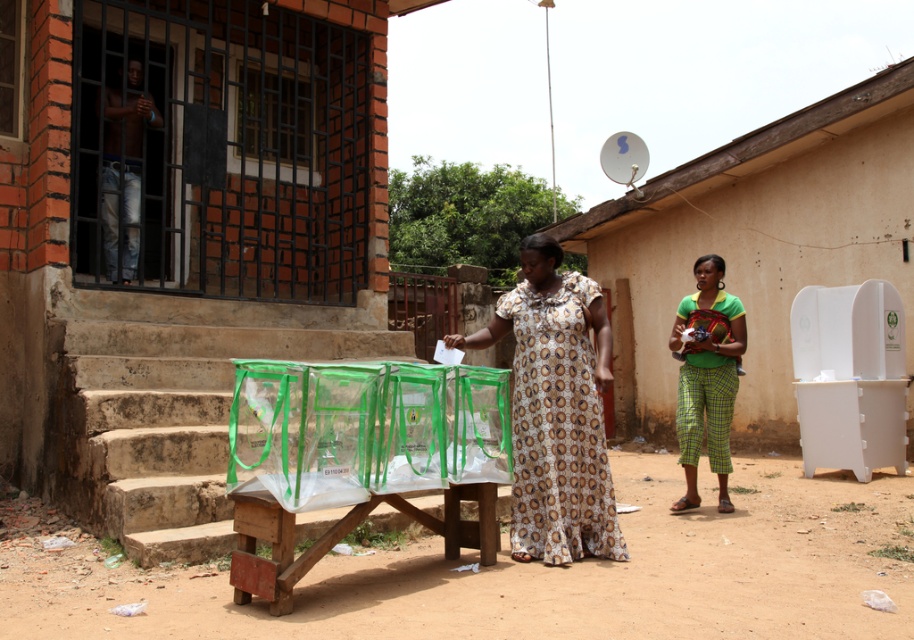
Question: Is green plastic bags at left wider than green plaid pants at right?

Choices:
 (A) no
 (B) yes

Answer: (B)

Question: Can you confirm if printed fabric dress at center is positioned above jeans at left?

Choices:
 (A) yes
 (B) no

Answer: (B)

Question: Which of the following is the farthest from the observer?

Choices:
 (A) green plaid pants at right
 (B) jeans at left
 (C) green plastic bags at left
 (D) white plastic ballot box at center

Answer: (D)

Question: Estimate the real-world distances between objects in this image. Which object is farther from the green plaid pants at right?

Choices:
 (A) jeans at left
 (B) white plastic ballot box at center
 (C) green plastic bags at left
 (D) printed fabric dress at center

Answer: (A)

Question: Can you confirm if white plastic ballot box at center is positioned to the right of printed fabric dress at center?

Choices:
 (A) no
 (B) yes

Answer: (B)

Question: Which point is closer to the camera taking this photo?

Choices:
 (A) (758, 381)
 (B) (614, 508)
 (C) (110, 268)
 (D) (709, 272)

Answer: (B)